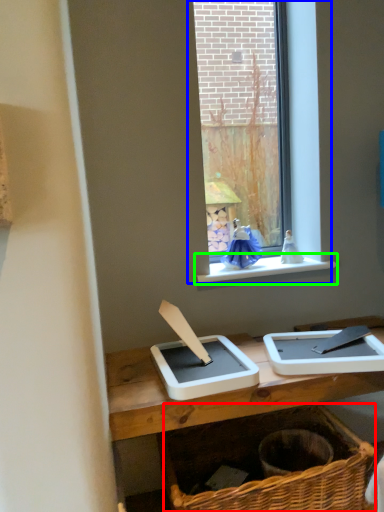
Question: Which is nearer to the basket (highlighted by a red box)? window (highlighted by a blue box) or window sill (highlighted by a green box).

Choices:
 (A) window
 (B) window sill

Answer: (B)